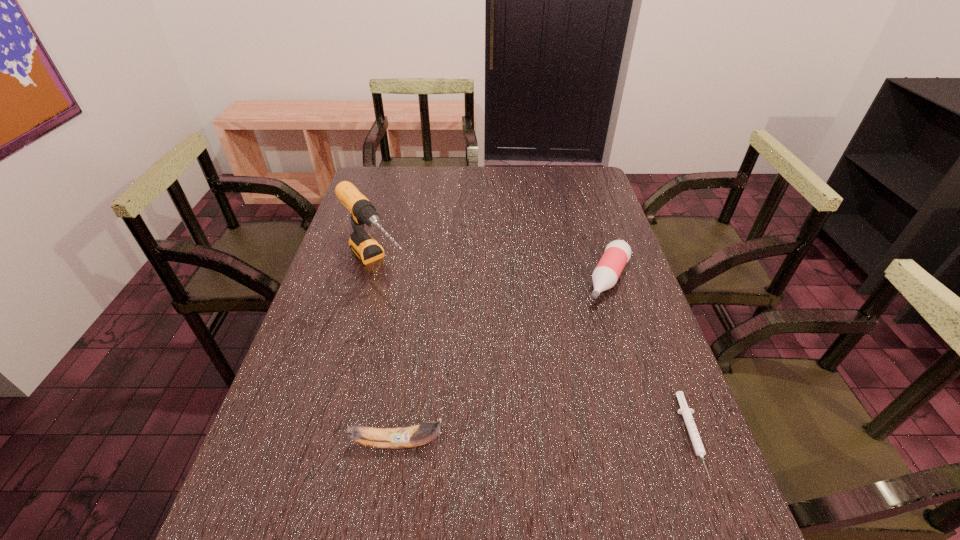
What are the coordinates of `the third shortest object` in the screenshot? It's located at (401, 437).

Where is `the shortest object`? The width and height of the screenshot is (960, 540). the shortest object is located at coordinates (686, 412).

You are a GUI agent. You are given a task and a screenshot of the screen. Output one action in this format:
    pyautogui.click(x=<x>, y=<y>)
    Task: Click on the tallest object
    This screenshot has height=540, width=960.
    Given the screenshot: What is the action you would take?
    pyautogui.click(x=366, y=248)

Locate an element on the screen. This screenshot has width=960, height=540. the second shortest object is located at coordinates (617, 253).

The image size is (960, 540). What are the coordinates of `vacant space located 0.400m on the peel of the second tallest object` in the screenshot? It's located at (635, 443).

Find the location of `vacant space located on the left of the shortest object`. vacant space located on the left of the shortest object is located at coordinates (581, 436).

This screenshot has height=540, width=960. What are the coordinates of `free region located 0.290m on the handle side of the drill` in the screenshot? It's located at (448, 360).

Find the location of a particular element. The image size is (960, 540). free spot located 0.220m on the handle side of the drill is located at coordinates (433, 342).

Locate an element on the screen. Image resolution: width=960 pixels, height=540 pixels. free location located on the handle side of the drill is located at coordinates (460, 373).

This screenshot has height=540, width=960. I want to click on free space located with the cap open on the second shortest object, so click(577, 353).